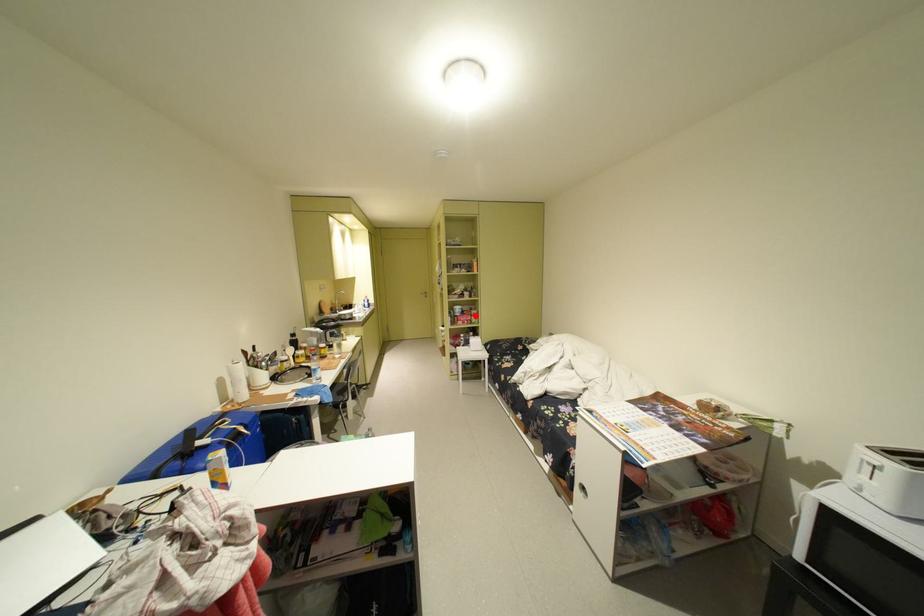
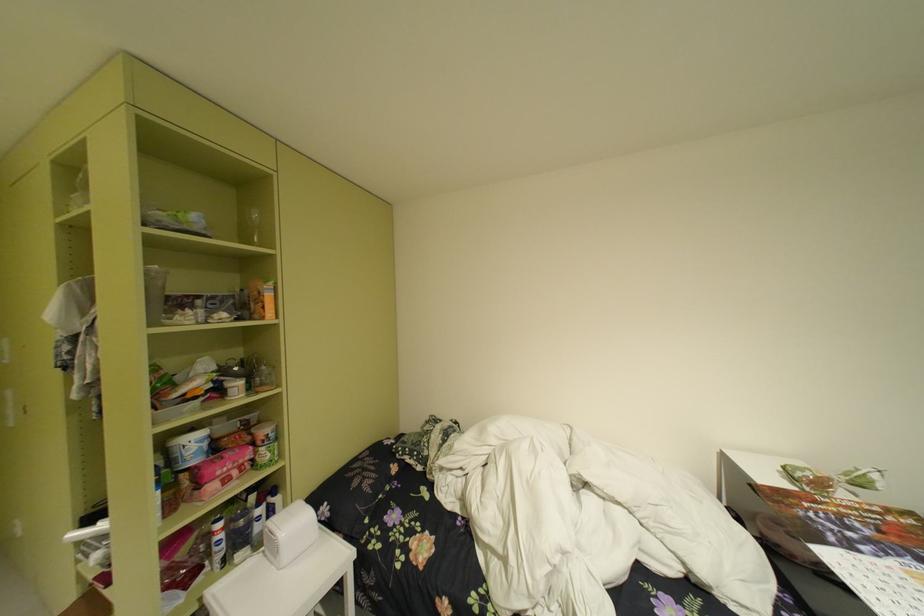
Locate, in the second image, the point that corresponds to the highlighted location in the first image.

(238, 455)